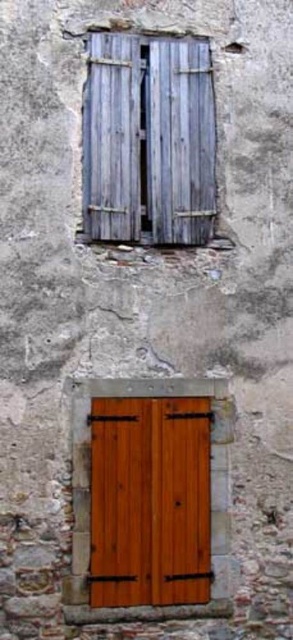
Can you confirm if weathered wood shutters at upper center is bigger than wooden door at center?

Yes.

Looking at this image, can you confirm if weathered wood shutters at upper center is smaller than wooden door at center?

Incorrect, weathered wood shutters at upper center is not smaller in size than wooden door at center.

Locate an element on the screen. weathered wood shutters at upper center is located at coordinates (149, 140).

The width and height of the screenshot is (293, 640). I want to click on weathered wood shutters at upper center, so coord(149,140).